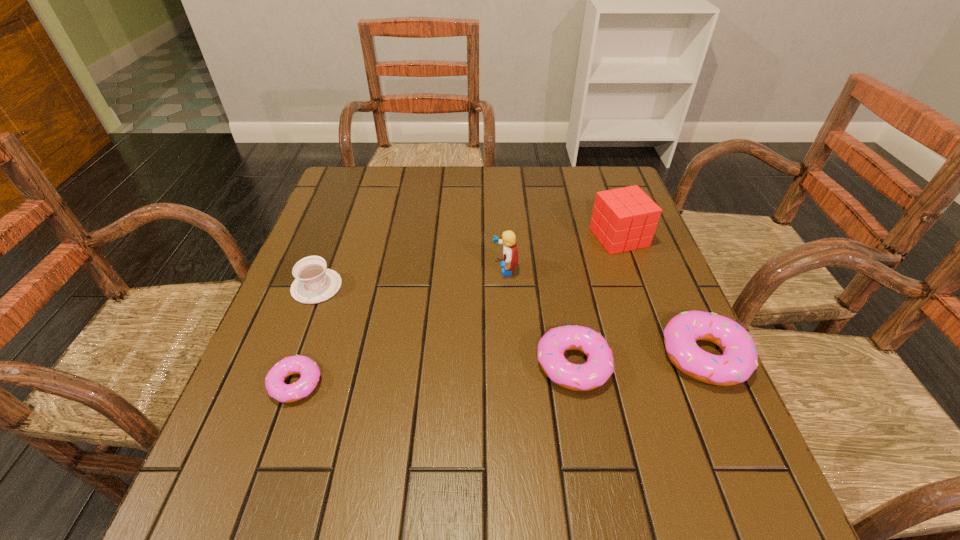
You are a GUI agent. You are given a task and a screenshot of the screen. Output one action in this format:
    pyautogui.click(x=<x>, y=<y>)
    Task: Click on the object that is the third closest to the third object from left to right
    
    Given the screenshot: What is the action you would take?
    pyautogui.click(x=739, y=360)

At what (x,y) coordinates should I click in order to perform the action: click on the closest object to the shortest object. Please return your answer as a coordinate pair (x, y). This screenshot has height=540, width=960. Looking at the image, I should click on (314, 283).

Find the location of `doughnut object that ranks as the second closest to the fourth object from left to right`. doughnut object that ranks as the second closest to the fourth object from left to right is located at coordinates (298, 364).

Select which doughnut is the third closest to the cube. Please provide its 2D coordinates. Your answer should be formatted as a tuple, i.e. [(x, y)], where the tuple contains the x and y coordinates of a point satisfying the conditions above.

[(298, 364)]

Where is `vacant area that satisfies the following two spatial constraints: 1. on the front-facing side of the third object from left to right; 2. on the left side of the rightmost doughnut`? vacant area that satisfies the following two spatial constraints: 1. on the front-facing side of the third object from left to right; 2. on the left side of the rightmost doughnut is located at coordinates (510, 356).

You are a GUI agent. You are given a task and a screenshot of the screen. Output one action in this format:
    pyautogui.click(x=<x>, y=<y>)
    Task: Click on the vacant region that satisfies the following two spatial constraints: 1. on the back side of the second tallest doughnut; 2. on the left side of the cube
    The image size is (960, 540).
    Given the screenshot: What is the action you would take?
    pyautogui.click(x=550, y=237)

Locate an element on the screen. This screenshot has height=540, width=960. free spot that satisfies the following two spatial constraints: 1. on the back side of the rightmost doughnut; 2. on the left side of the shortest object is located at coordinates (305, 356).

Identify the location of free spot that satisfies the following two spatial constraints: 1. on the front-facing side of the Lego; 2. on the left side of the fourth object from left to right. Image resolution: width=960 pixels, height=540 pixels. (511, 365).

This screenshot has width=960, height=540. In order to click on blank area in the image that satisfies the following two spatial constraints: 1. on the front-facing side of the Lego; 2. on the left side of the second doughnut from right to left in this screenshot , I will do `click(511, 365)`.

Image resolution: width=960 pixels, height=540 pixels. In order to click on free space that satisfies the following two spatial constraints: 1. on the front-facing side of the rightmost doughnut; 2. on the left side of the third object from left to right in this screenshot , I will do `click(510, 356)`.